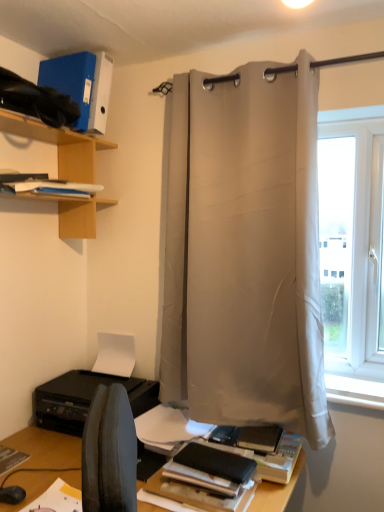
Question: Is matte black book at lower center, placed as the second paperback book when sorted from top to bottom, bigger than white smooth window sill at lower right?

Choices:
 (A) no
 (B) yes

Answer: (B)

Question: Considering the relative sizes of matte black book at lower center, which is counted as the first paperback book, starting from the bottom, and white smooth window sill at lower right in the image provided, is matte black book at lower center, which is counted as the first paperback book, starting from the bottom, wider than white smooth window sill at lower right?

Choices:
 (A) no
 (B) yes

Answer: (B)

Question: Is matte black book at lower center, marked as the 1th paperback book in a right-to-left arrangement, located outside white smooth window sill at lower right?

Choices:
 (A) no
 (B) yes

Answer: (B)

Question: From a real-world perspective, does matte black book at lower center, which is the second paperback book from back to front, sit lower than white smooth window sill at lower right?

Choices:
 (A) yes
 (B) no

Answer: (A)

Question: Can you confirm if matte black book at lower center, which is counted as the first paperback book, starting from the bottom, is shorter than white smooth window sill at lower right?

Choices:
 (A) no
 (B) yes

Answer: (A)

Question: From the image's perspective, does matte black book at lower center, which is counted as the first paperback book, starting from the bottom, appear lower than white smooth window sill at lower right?

Choices:
 (A) no
 (B) yes

Answer: (B)

Question: From the image's perspective, is white matte paper at lower center located above blue matte folder at upper left, arranged as the 1th paperback book when viewed from the left?

Choices:
 (A) no
 (B) yes

Answer: (A)

Question: Is the depth of white matte paper at lower center less than that of blue matte folder at upper left, which is the 2th paperback book in right-to-left order?

Choices:
 (A) no
 (B) yes

Answer: (A)

Question: Are white matte paper at lower center and blue matte folder at upper left, which is counted as the first paperback book, starting from the back, located far from each other?

Choices:
 (A) yes
 (B) no

Answer: (A)

Question: Can you confirm if white matte paper at lower center is positioned to the left of blue matte folder at upper left, which is the 2th paperback book in right-to-left order?

Choices:
 (A) yes
 (B) no

Answer: (B)

Question: From a real-world perspective, does white matte paper at lower center sit lower than blue matte folder at upper left, the second paperback book when ordered from front to back?

Choices:
 (A) no
 (B) yes

Answer: (B)

Question: Considering the relative sizes of white matte paper at lower center and blue matte folder at upper left, the second paperback book when ordered from front to back, in the image provided, is white matte paper at lower center shorter than blue matte folder at upper left, the second paperback book when ordered from front to back,?

Choices:
 (A) no
 (B) yes

Answer: (B)

Question: From the image's perspective, is white matte paper at lower center below white smooth window sill at lower right?

Choices:
 (A) yes
 (B) no

Answer: (B)